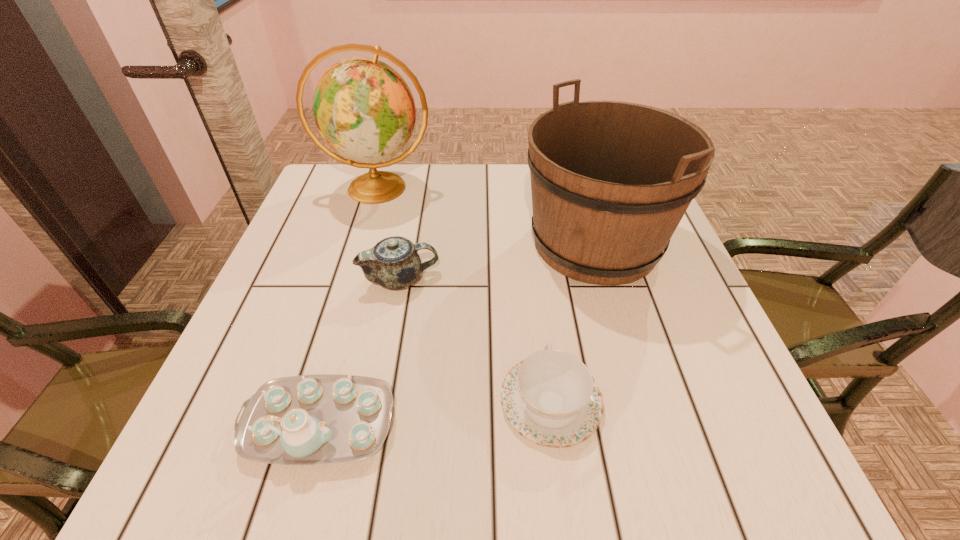
Where is `vacant region located 0.370m on the handle side of the shortest object`? The width and height of the screenshot is (960, 540). vacant region located 0.370m on the handle side of the shortest object is located at coordinates (529, 232).

At what (x,y) coordinates should I click in order to perform the action: click on globe located at the far edge. Please return your answer as a coordinate pair (x, y). Looking at the image, I should click on (363, 108).

Where is `bucket present at the far edge`? Image resolution: width=960 pixels, height=540 pixels. bucket present at the far edge is located at coordinates (610, 181).

The width and height of the screenshot is (960, 540). I want to click on globe present at the left edge, so click(x=363, y=108).

Where is `chinaware that is positioned at the left edge`? The width and height of the screenshot is (960, 540). chinaware that is positioned at the left edge is located at coordinates (320, 419).

You are a GUI agent. You are given a task and a screenshot of the screen. Output one action in this format:
    pyautogui.click(x=<x>, y=<y>)
    Task: Click on the object at the right edge
    
    Given the screenshot: What is the action you would take?
    pyautogui.click(x=610, y=181)

You are a GUI agent. You are given a task and a screenshot of the screen. Output one action in this format:
    pyautogui.click(x=<x>, y=<y>)
    Task: Click on the object situated at the far left corner
    The height and width of the screenshot is (540, 960).
    Given the screenshot: What is the action you would take?
    pyautogui.click(x=363, y=108)

Find the location of a particular element. object at the near left corner is located at coordinates (320, 419).

Where is `object at the far right corner`? Image resolution: width=960 pixels, height=540 pixels. object at the far right corner is located at coordinates (610, 181).

At what (x,y) coordinates should I click in order to perform the action: click on blank space at the far edge of the desktop. Please return your answer as a coordinate pair (x, y). Looking at the image, I should click on (453, 186).